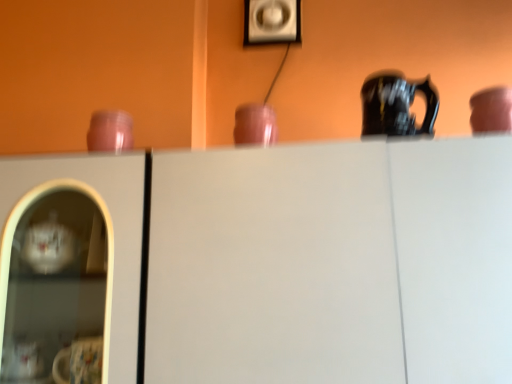
Question: Considering the positions of point (266, 107) and point (431, 372), is point (266, 107) closer or farther from the camera than point (431, 372)?

Choices:
 (A) farther
 (B) closer

Answer: (A)

Question: In the image, is matte pink cup at center, positioned as the second tableware in left-to-right order, positioned in front of or behind white matte cabinet at center?

Choices:
 (A) behind
 (B) front

Answer: (A)

Question: Considering the real-world distances, which object is closest to the matte pink cup at upper right, placed as the 3th tableware when sorted from left to right?

Choices:
 (A) matte plastic picture frame at upper center
 (B) matte pink cup at center, positioned as the second tableware in left-to-right order
 (C) white matte cabinet at center
 (D) pink glossy jar at left, placed as the third tableware when sorted from right to left
 (E) black glossy jug at upper right

Answer: (E)

Question: Estimate the real-world distances between objects in this image. Which object is farther from the black glossy jug at upper right?

Choices:
 (A) matte pink cup at center, positioned as the second tableware in left-to-right order
 (B) pink glossy jar at left, which appears as the 1th tableware when viewed from the left
 (C) white matte cabinet at center
 (D) matte pink cup at upper right, placed as the 3th tableware when sorted from left to right
 (E) matte plastic picture frame at upper center

Answer: (E)